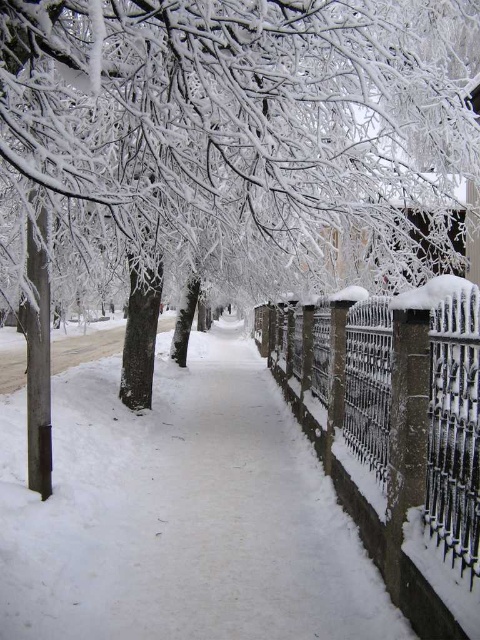
You are standing at the entrance of the winter scene and want to walk directly towards the white snow pavement at center. Based on the coordinates provided, is the pavement closer to the foreground or the background of the image?

The white snow pavement at center is located at point coordinates that suggest it is closer to the foreground since lower y values typically indicate closer proximity in image coordinate systems.